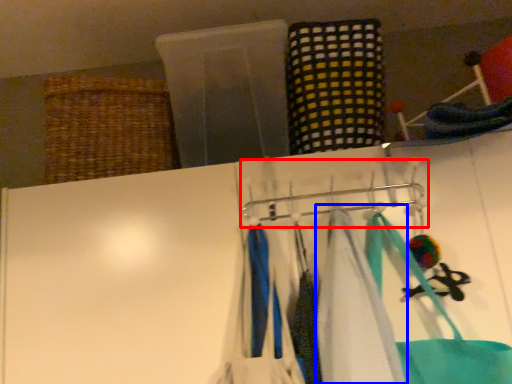
Question: Which object appears farthest to the camera in this image, hanger (highlighted by a red box) or towel (highlighted by a blue box)?

Choices:
 (A) hanger
 (B) towel

Answer: (A)